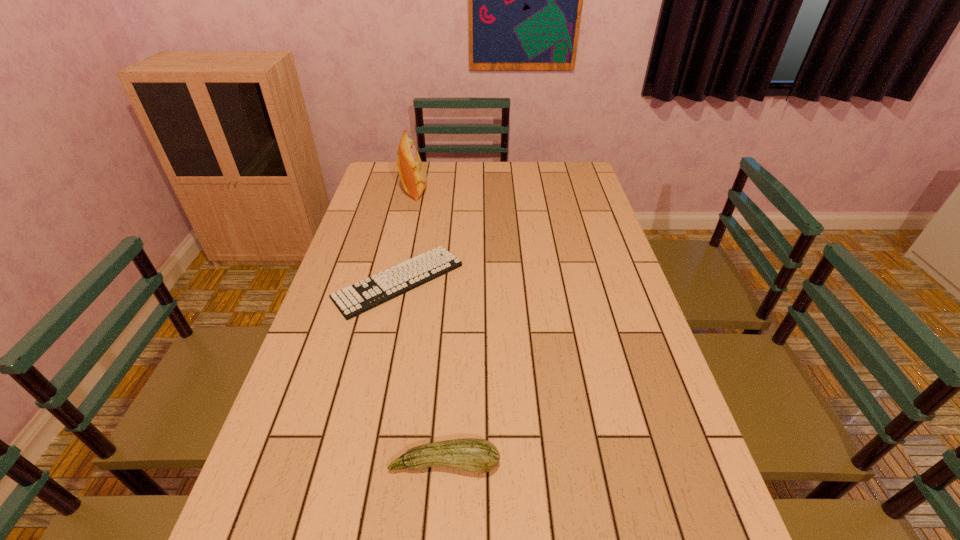
Locate an element on the screen. The height and width of the screenshot is (540, 960). crisp (potato chip) at the left edge is located at coordinates (413, 176).

Find the location of a particular element. computer keyboard located at the left edge is located at coordinates (367, 294).

Identify the location of object that is at the far left corner. Image resolution: width=960 pixels, height=540 pixels. (413, 176).

Identify the location of vacant space at the far edge. (535, 168).

The height and width of the screenshot is (540, 960). I want to click on free spot at the left edge of the desktop, so click(x=353, y=342).

Identify the location of free spot at the right edge of the desktop. [593, 272].

I want to click on vacant region at the far left corner, so click(x=379, y=191).

The width and height of the screenshot is (960, 540). Identify the location of empty space that is in between the zucchini and the second nearest object. (421, 372).

This screenshot has width=960, height=540. Identify the location of free space between the computer keyboard and the farthest object. (406, 236).

Image resolution: width=960 pixels, height=540 pixels. Find the location of `free area in between the farthest object and the computer keyboard`. free area in between the farthest object and the computer keyboard is located at coordinates (406, 236).